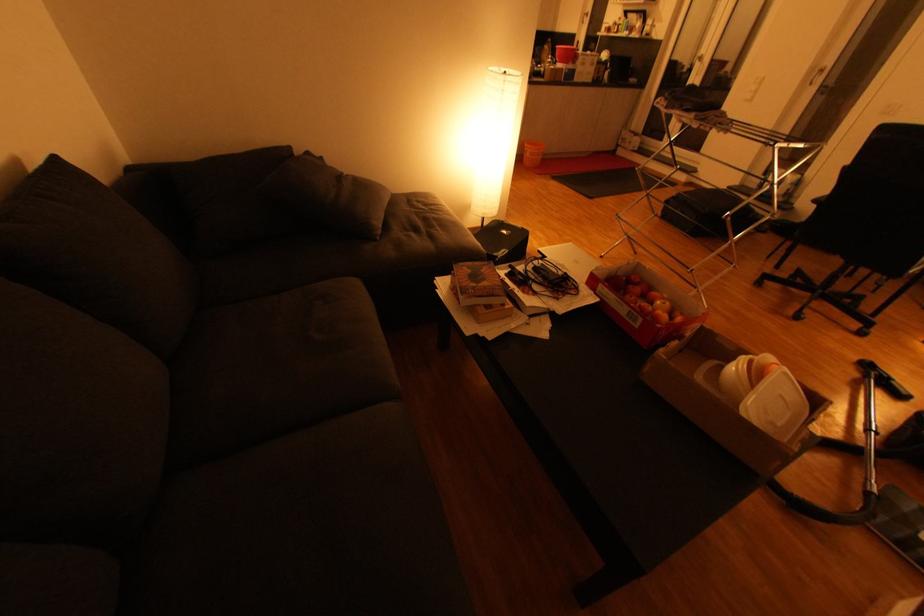
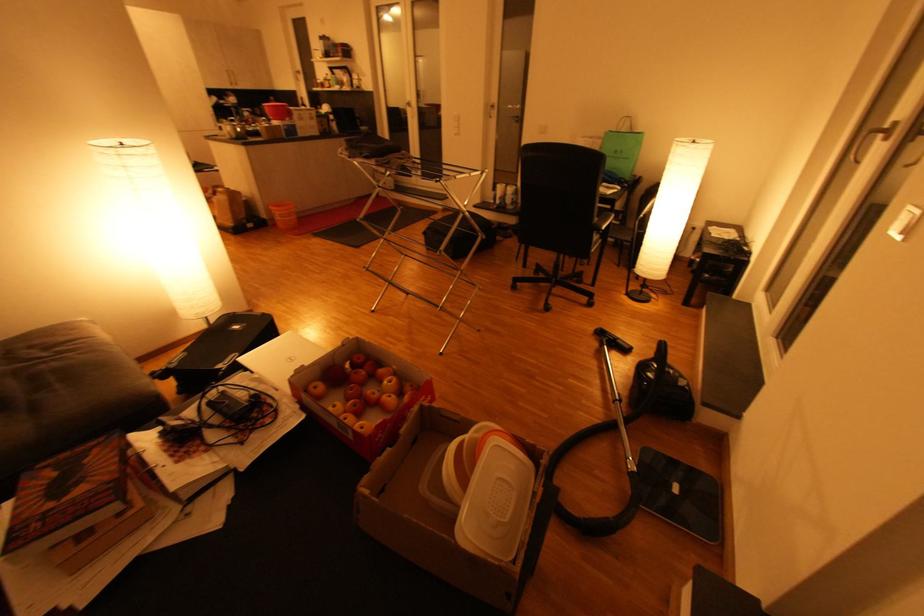
In the second image, find the point that corresponds to (771,277) in the first image.

(520, 281)